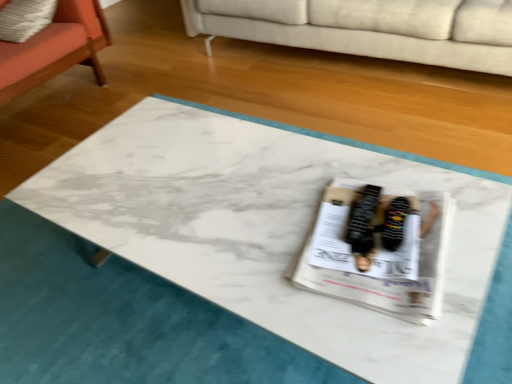
The image size is (512, 384). I want to click on free space to the left of black suede sneakers at center, so click(316, 246).